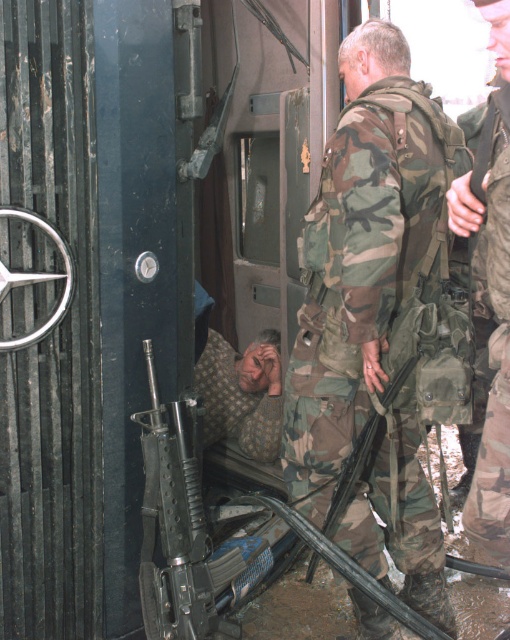
You are a medic in the military vehicle. You need to reach the injured person lying on the floor. There is a camouflage fabric uniform at center and a camouflage uniform at center in your way. Which object is closer to you so you can step over it?

The camouflage fabric uniform at center is below camouflage uniform at center, so the camouflage fabric uniform at center is closer to you and you can step over it.

You are a medic in the military vehicle. You need to quickly assess the situation. Which object is taller between the camouflage fabric uniform at center and the camouflage uniform at center?

The camouflage fabric uniform at center is taller than the camouflage uniform at center.

You are a medic in the military vehicle. You need to quickly assess the situation. Which item is larger in size between the camouflage fabric uniform at center and the camouflage uniform at center?

The camouflage fabric uniform at center is bigger than the camouflage uniform at center, so the camouflage fabric uniform at center is larger in size.